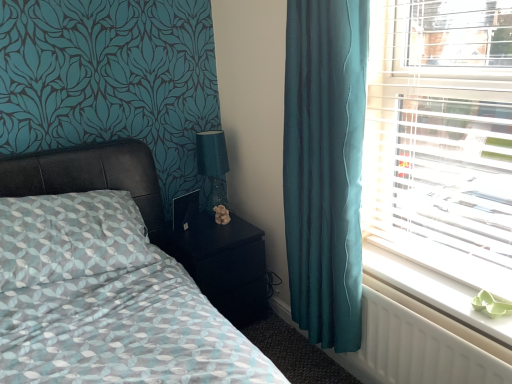
Question: From their relative heights in the image, would you say matte black bed at left is taller or shorter than white plastic blinds at right?

Choices:
 (A) short
 (B) tall

Answer: (A)

Question: Is point (17, 349) closer or farther from the camera than point (497, 226)?

Choices:
 (A) farther
 (B) closer

Answer: (B)

Question: Which is farther from the white plastic blinds at right?

Choices:
 (A) black glossy nightstand at center
 (B) white plastic radiator at lower right
 (C) teal glass table lamp at upper right
 (D) matte black bed at left
 (E) teal fabric curtain at right

Answer: (C)

Question: Which object is the closest to the white plastic blinds at right?

Choices:
 (A) white plastic radiator at lower right
 (B) black glossy nightstand at center
 (C) matte black bed at left
 (D) white plastic radiator at lower right
 (E) teal glass table lamp at upper right

Answer: (A)